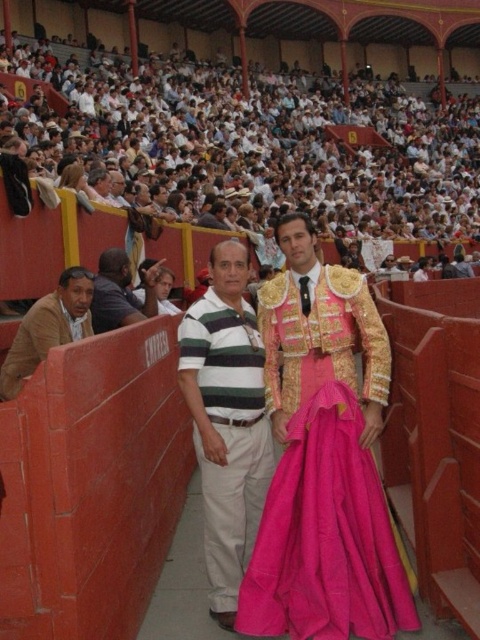
Question: Is pink satin dress at center bigger than brown leather jacket at left?

Choices:
 (A) yes
 (B) no

Answer: (B)

Question: Which point appears closest to the camera in this image?

Choices:
 (A) (215, 308)
 (B) (96, 296)
 (C) (71, 298)
 (D) (340, 516)

Answer: (D)

Question: Considering the relative positions of brown leather jacket at left and dark blue shirt at left in the image provided, where is brown leather jacket at left located with respect to dark blue shirt at left?

Choices:
 (A) left
 (B) right

Answer: (A)

Question: Is pink satin dress at center in front of brown leather jacket at left?

Choices:
 (A) no
 (B) yes

Answer: (B)

Question: Which point is closer to the camera?

Choices:
 (A) white cotton shirt at upper center
 (B) dark blue shirt at left
 (C) pink satin dress at center

Answer: (C)

Question: Which point is closer to the camera taking this photo?

Choices:
 (A) (41, 353)
 (B) (282, 500)
 (C) (233, 403)
 (D) (137, 300)

Answer: (B)